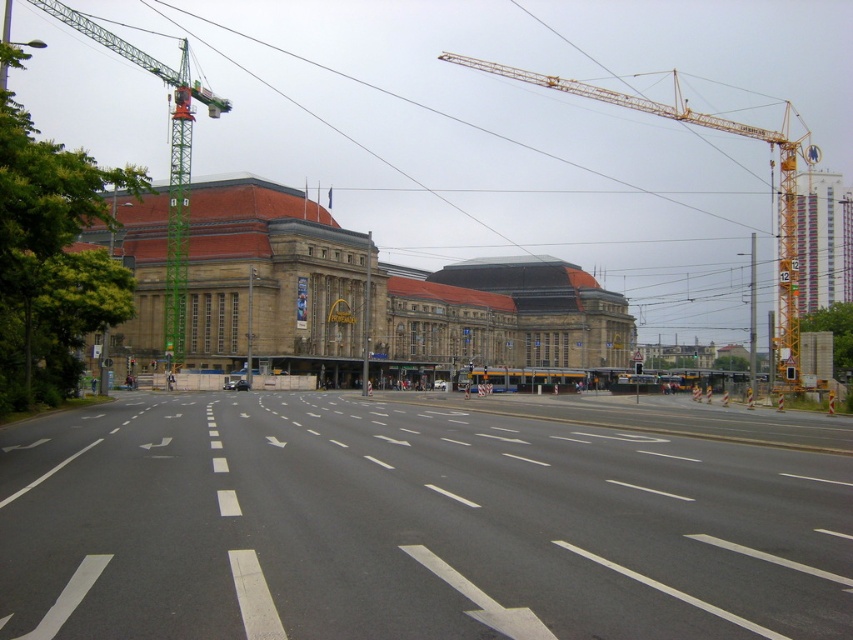
Question: Considering the relative positions of brown stone building at center and green metal crane at left in the image provided, where is brown stone building at center located with respect to green metal crane at left?

Choices:
 (A) above
 (B) below

Answer: (B)

Question: Which point is farther to the camera?

Choices:
 (A) (366, 614)
 (B) (180, 236)
 (C) (796, 371)
 (D) (532, 276)

Answer: (D)

Question: Which of these objects is positioned closest to the yellow plastic traffic light at center?

Choices:
 (A) green metal crane at left
 (B) yellow metallic crane at upper right
 (C) red glass traffic light at center

Answer: (C)

Question: Does yellow metallic crane at upper right have a lesser width compared to green metal crane at left?

Choices:
 (A) no
 (B) yes

Answer: (B)

Question: In this image, where is asphalt road at center located relative to yellow metallic crane at upper right?

Choices:
 (A) left
 (B) right

Answer: (A)

Question: Which object is closer to the camera taking this photo?

Choices:
 (A) asphalt road at center
 (B) brown stone building at center
 (C) green metal crane at left

Answer: (A)